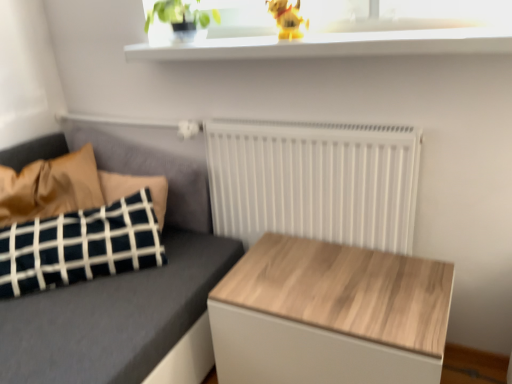
What do you see at coordinates (333, 45) in the screenshot?
I see `white glossy window sill at upper center` at bounding box center [333, 45].

This screenshot has width=512, height=384. I want to click on dark gray fabric couch at left, so click(122, 287).

Locate an element on the screen. white glossy window sill at upper center is located at coordinates (333, 45).

Measure the distance from dark gray fabric couch at left to white glossy window sill at upper center.

The distance of dark gray fabric couch at left from white glossy window sill at upper center is 26.24 inches.

Considering the sizes of dark gray fabric couch at left and white glossy window sill at upper center in the image, is dark gray fabric couch at left bigger or smaller than white glossy window sill at upper center?

In the image, dark gray fabric couch at left appears to be larger than white glossy window sill at upper center.

Is dark gray fabric couch at left at the right side of white glossy window sill at upper center?

Incorrect, dark gray fabric couch at left is not on the right side of white glossy window sill at upper center.

Is dark gray fabric couch at left with white glossy window sill at upper center?

dark gray fabric couch at left and white glossy window sill at upper center are not in contact.

Locate an element on the screen. The width and height of the screenshot is (512, 384). window sill below the yellow plastic dog at upper center (from a real-world perspective) is located at coordinates (333, 45).

Who is taller, white glossy window sill at upper center or yellow plastic dog at upper center?

yellow plastic dog at upper center.

Is white glossy window sill at upper center next to yellow plastic dog at upper center and touching it?

No, white glossy window sill at upper center is not in contact with yellow plastic dog at upper center.

Does white glossy window sill at upper center come behind yellow plastic dog at upper center?

No, white glossy window sill at upper center is in front of yellow plastic dog at upper center.

Does point (10, 373) come behind point (320, 197)?

No.

From a real-world perspective, is dark gray fabric couch at left above or below white matte radiator at center?

From a real-world perspective, dark gray fabric couch at left is physically below white matte radiator at center.

Is dark gray fabric couch at left positioned behind white matte radiator at center?

No, dark gray fabric couch at left is in front of white matte radiator at center.

Consider the image. Between dark gray fabric couch at left and white matte radiator at center, which one appears on the right side from the viewer's perspective?

Positioned to the right is white matte radiator at center.

From a real-world perspective, is green matte plant at upper center physically above black-and-white checkered pillow at left?

Yes, from a real-world perspective, green matte plant at upper center is on top of black-and-white checkered pillow at left.

Which is more to the left, green matte plant at upper center or black-and-white checkered pillow at left?

black-and-white checkered pillow at left.

Which object is further away from the camera, green matte plant at upper center or black-and-white checkered pillow at left?

green matte plant at upper center is more distant.

Measure the distance between green matte plant at upper center and black-and-white checkered pillow at left.

green matte plant at upper center is 30.32 inches from black-and-white checkered pillow at left.

What are the coordinates of `plant behind the dark gray fabric couch at left` in the screenshot? It's located at tap(176, 14).

Which is in front, dark gray fabric couch at left or green matte plant at upper center?

dark gray fabric couch at left.

Does point (207, 215) come closer to viewer compared to point (149, 11)?

That is False.

Is dark gray fabric couch at left at the right side of green matte plant at upper center?

In fact, dark gray fabric couch at left is to the left of green matte plant at upper center.

In the image, there is a black-and-white checkered pillow at left. Identify the location of table below it (from the image's perspective). This screenshot has width=512, height=384. (329, 315).

From a real-world perspective, which object stands above the other?

black-and-white checkered pillow at left, from a real-world perspective.

Between wooden table at center and black-and-white checkered pillow at left, which one has smaller size?

black-and-white checkered pillow at left is smaller.

Does wooden table at center contain black-and-white checkered pillow at left?

Definitely not — black-and-white checkered pillow at left is not inside wooden table at center.

Is black-and-white checkered pillow at left turned away from wooden table at center?

black-and-white checkered pillow at left does not have its back to wooden table at center.

Considering the sizes of objects black-and-white checkered pillow at left and wooden table at center in the image provided, who is shorter, black-and-white checkered pillow at left or wooden table at center?

wooden table at center.

Is black-and-white checkered pillow at left far from wooden table at center?

A: No, black-and-white checkered pillow at left is not far away from wooden table at center.

Considering the sizes of objects black-and-white checkered pillow at left and wooden table at center in the image provided, who is bigger, black-and-white checkered pillow at left or wooden table at center?

Bigger between the two is wooden table at center.

This screenshot has height=384, width=512. I want to click on window sill in front of the dark gray fabric couch at left, so click(333, 45).

Locate an element on the screen. The image size is (512, 384). window sill located on the right of yellow plastic dog at upper center is located at coordinates (333, 45).

Looking at the image, which one is located closer to black-and-white checkered pillow at left, white matte radiator at center or dark gray fabric couch at left?

The object closer to black-and-white checkered pillow at left is dark gray fabric couch at left.

Which object lies nearer to the anchor point yellow plastic dog at upper center, black-and-white checkered pillow at left or white glossy window sill at upper center?

white glossy window sill at upper center is positioned closer to the anchor yellow plastic dog at upper center.

Based on their spatial positions, is white glossy window sill at upper center or yellow plastic dog at upper center closer to white matte radiator at center?

Based on the image, white glossy window sill at upper center appears to be nearer to white matte radiator at center.

Estimate the real-world distances between objects in this image. Which object is further from dark gray fabric couch at left, yellow plastic dog at upper center or black-and-white checkered pillow at left?

yellow plastic dog at upper center is further to dark gray fabric couch at left.

Looking at the image, which one is located further to green matte plant at upper center, white matte radiator at center or wooden table at center?

wooden table at center.

Considering their positions, is wooden table at center positioned further to dark gray fabric couch at left than green matte plant at upper center?

green matte plant at upper center is positioned further to the anchor dark gray fabric couch at left.

Based on their spatial positions, is white matte radiator at center or dark gray fabric couch at left closer to green matte plant at upper center?

white matte radiator at center is positioned closer to the anchor green matte plant at upper center.

When comparing their distances from black-and-white checkered pillow at left, does white matte radiator at center or yellow plastic dog at upper center seem closer?

white matte radiator at center is positioned closer to the anchor black-and-white checkered pillow at left.

This screenshot has height=384, width=512. I want to click on window sill between green matte plant at upper center and dark gray fabric couch at left in the vertical direction, so click(333, 45).

This screenshot has width=512, height=384. I want to click on studio couch that lies between yellow plastic dog at upper center and wooden table at center from top to bottom, so click(122, 287).

Where is `radiator between dark gray fabric couch at left and wooden table at center from left to right`? Image resolution: width=512 pixels, height=384 pixels. radiator between dark gray fabric couch at left and wooden table at center from left to right is located at coordinates (314, 181).

Find the location of `studio couch between black-and-white checkered pillow at left and wooden table at center from left to right`. studio couch between black-and-white checkered pillow at left and wooden table at center from left to right is located at coordinates (122, 287).